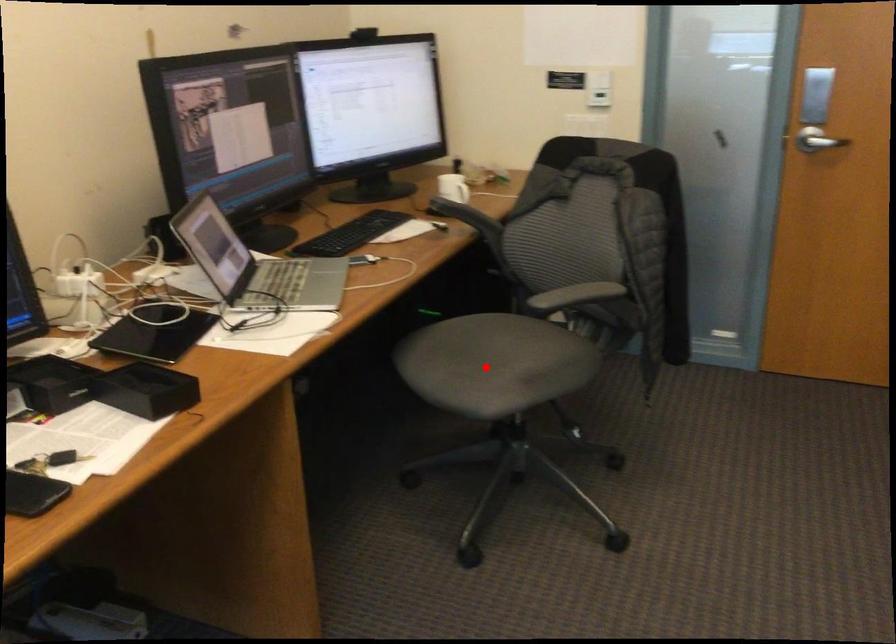
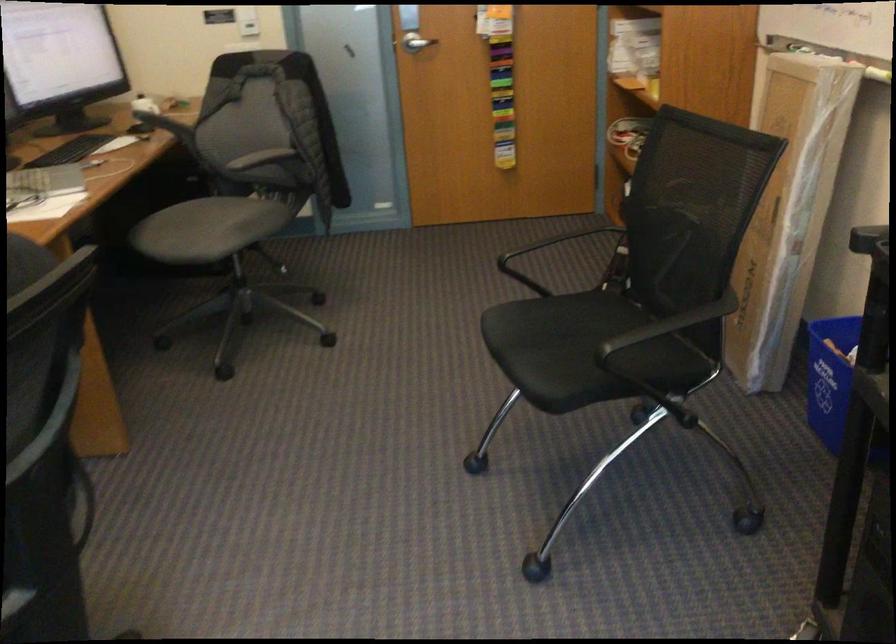
Question: I am providing you with two images of the same scene from different viewpoints. In image1, a red point is highlighted. Considering the same 3D point in image2, which of the following is correct?

Choices:
 (A) It is closer
 (B) It is farther

Answer: (B)